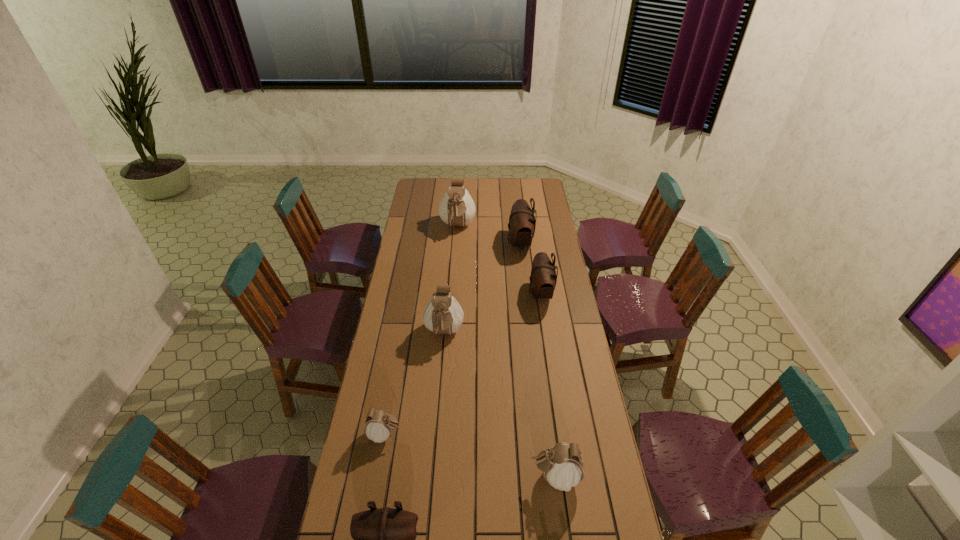
I want to click on vacant point that satisfies the following two spatial constraints: 1. with the flap open on the biggest brown pouch; 2. on the front-facing side of the fourth farthest object, so click(531, 333).